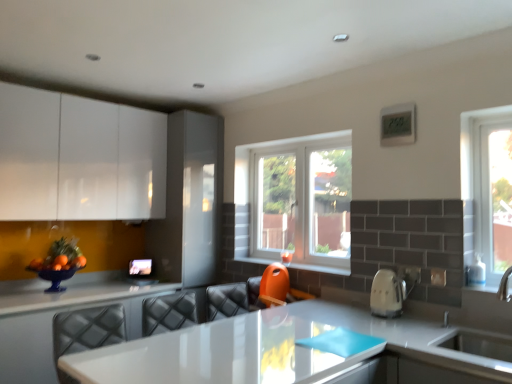
Question: Can you confirm if white glossy sink at lower right is taller than white plastic window at center?

Choices:
 (A) no
 (B) yes

Answer: (A)

Question: Is white glossy sink at lower right located outside white plastic window at center?

Choices:
 (A) yes
 (B) no

Answer: (A)

Question: Is white glossy sink at lower right further to camera compared to white plastic window at center?

Choices:
 (A) no
 (B) yes

Answer: (A)

Question: Is white glossy sink at lower right far from white plastic window at center?

Choices:
 (A) no
 (B) yes

Answer: (B)

Question: Does white glossy sink at lower right turn towards white plastic window at center?

Choices:
 (A) yes
 (B) no

Answer: (B)

Question: From the image's perspective, does white glossy sink at lower right appear higher than white plastic window at center?

Choices:
 (A) no
 (B) yes

Answer: (A)

Question: Is white plastic window at center at the back of orange plastic swivel chair at center?

Choices:
 (A) yes
 (B) no

Answer: (B)

Question: Is orange plastic swivel chair at center surrounding white plastic window at center?

Choices:
 (A) yes
 (B) no

Answer: (B)

Question: Does orange plastic swivel chair at center have a greater width compared to white plastic window at center?

Choices:
 (A) yes
 (B) no

Answer: (A)

Question: Considering the relative sizes of orange plastic swivel chair at center and white plastic window at center in the image provided, is orange plastic swivel chair at center taller than white plastic window at center?

Choices:
 (A) yes
 (B) no

Answer: (B)

Question: Is orange plastic swivel chair at center positioned behind white plastic window at center?

Choices:
 (A) yes
 (B) no

Answer: (B)

Question: Does orange plastic swivel chair at center have a lesser height compared to white plastic window at center?

Choices:
 (A) yes
 (B) no

Answer: (A)

Question: Could you tell me if white glossy countertop at lower center is turned towards orange plastic at center?

Choices:
 (A) yes
 (B) no

Answer: (B)